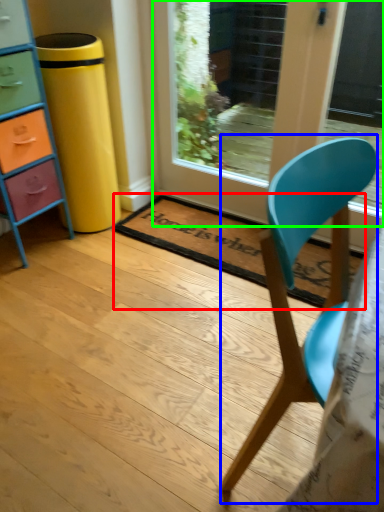
Question: Based on their relative distances, which object is nearer to mat (highlighted by a red box)? Choose from chair (highlighted by a blue box) and door (highlighted by a green box).

Choices:
 (A) chair
 (B) door

Answer: (B)